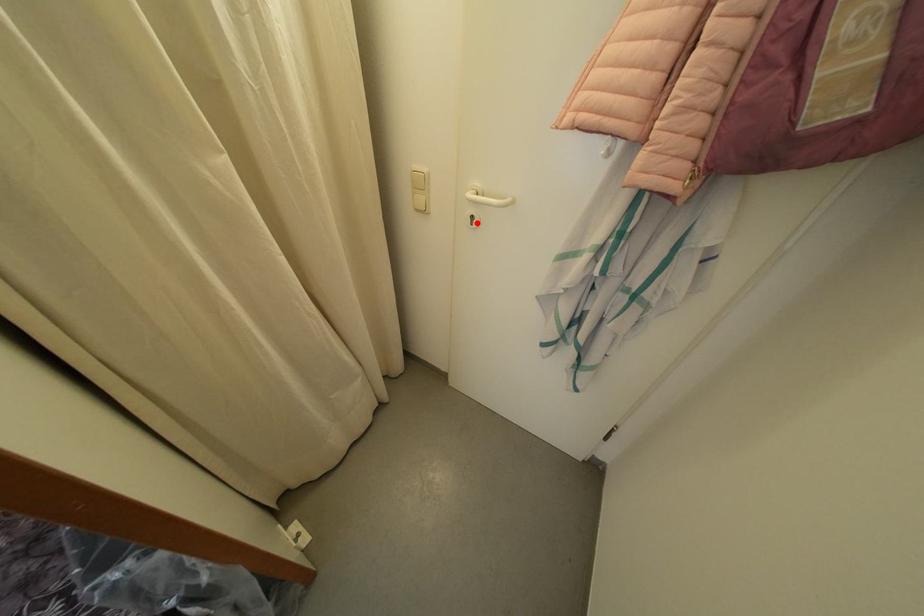
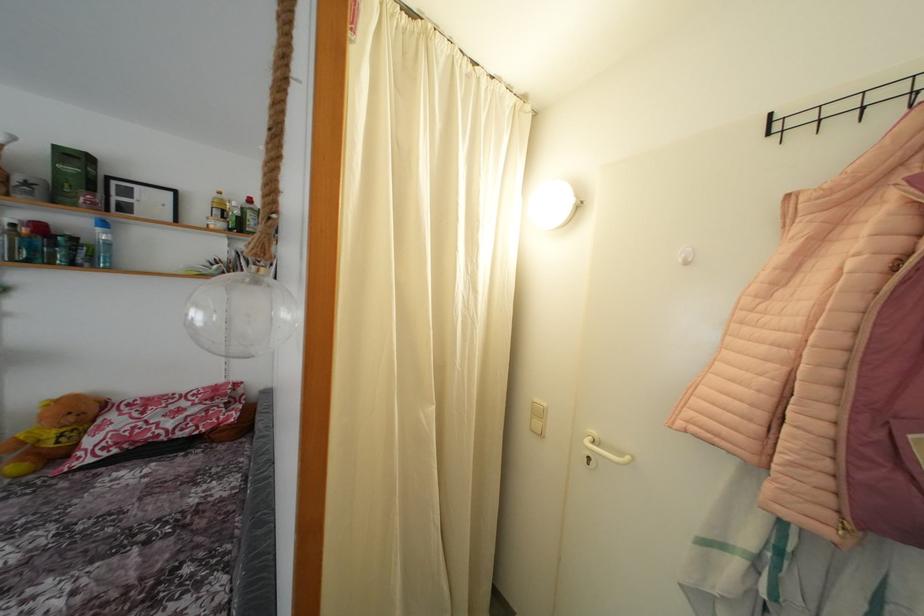
In the second image, find the point that corresponds to the highlighted location in the first image.

(593, 464)